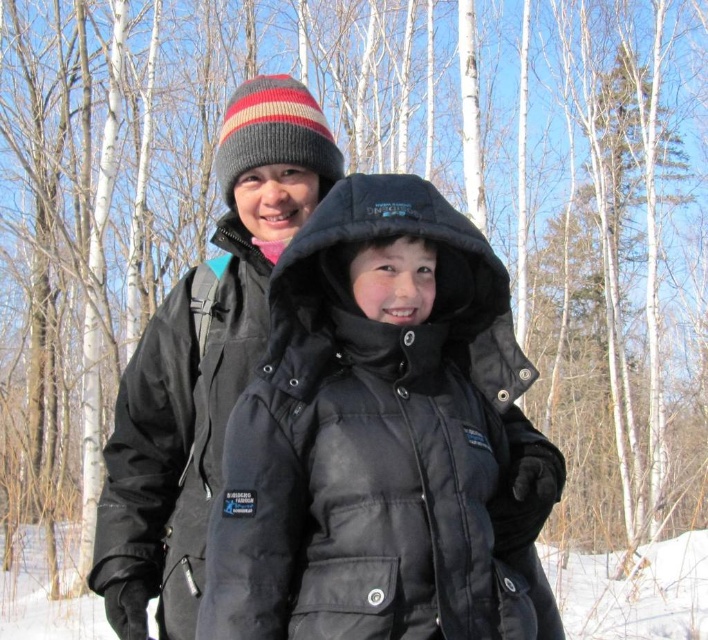
You are planning to take a winter hike and need to decide which jacket to wear. You have both the matte black jacket at center and the black softshell jacket at upper center. Based on their positions in the image, which jacket is more visible to you from your current viewpoint?

The matte black jacket at center is located above the black softshell jacket at upper center, so the matte black jacket at center is more visible from your current viewpoint.

You are standing in a snowy forest and see a matte black jacket at center. If you want to reach it within 2 meters, can you do it?

The matte black jacket at center is 1.97 meters away from the viewer, so yes, you can reach it within 2 meters.

You are a photographer trying to capture a photo of both the matte black jacket at center and the black softshell jacket at upper center. Since you want both jackets to be in focus, which one should you adjust your camera focus on first?

You should focus on the matte black jacket at center first because it is closer to the viewer than the black softshell jacket at upper center, ensuring both are in focus by starting with the nearest subject.